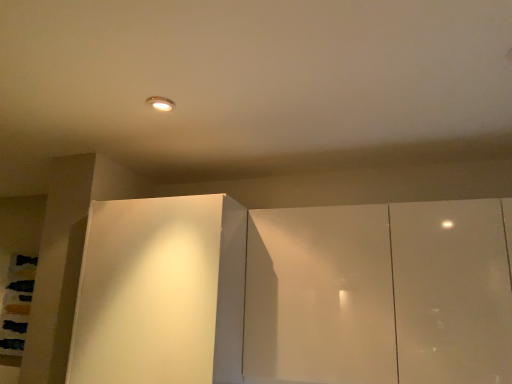
Question: Is glossy white cupboard at center bigger or smaller than white glossy cabinet at center?

Choices:
 (A) small
 (B) big

Answer: (A)

Question: Considering the relative positions of glossy white cupboard at center and white glossy cabinet at center in the image provided, is glossy white cupboard at center to the left or to the right of white glossy cabinet at center?

Choices:
 (A) right
 (B) left

Answer: (A)

Question: From a real-world perspective, is glossy white cupboard at center above or below white glossy cabinet at center?

Choices:
 (A) below
 (B) above

Answer: (B)

Question: Is white glossy cabinet at center bigger or smaller than glossy white cupboard at center?

Choices:
 (A) big
 (B) small

Answer: (A)

Question: In the image, is white glossy cabinet at center on the left side or the right side of glossy white cupboard at center?

Choices:
 (A) left
 (B) right

Answer: (A)

Question: Looking at their shapes, would you say white glossy cabinet at center is wider or thinner than glossy white cupboard at center?

Choices:
 (A) thin
 (B) wide

Answer: (B)

Question: Is white glossy cabinet at center in front of or behind glossy white cupboard at center in the image?

Choices:
 (A) front
 (B) behind

Answer: (B)